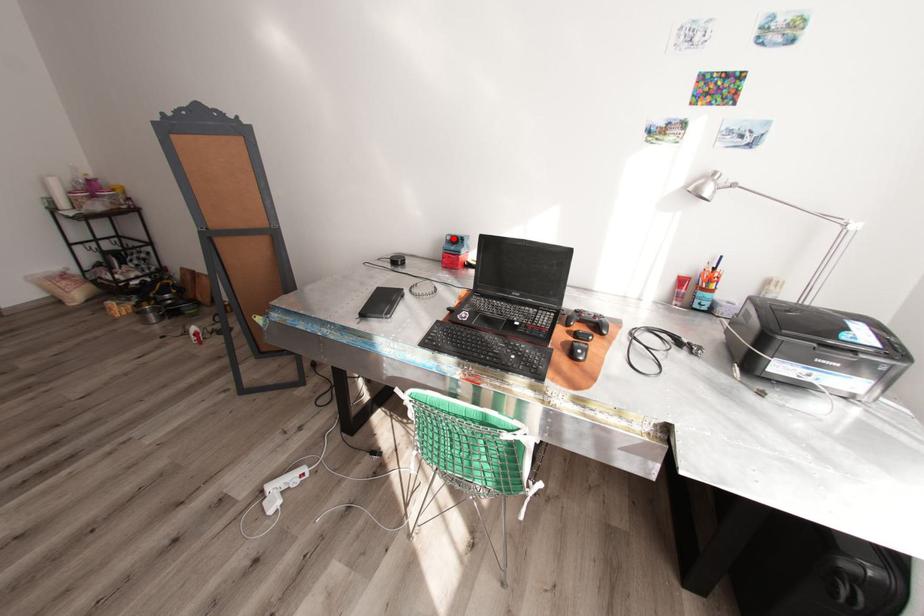
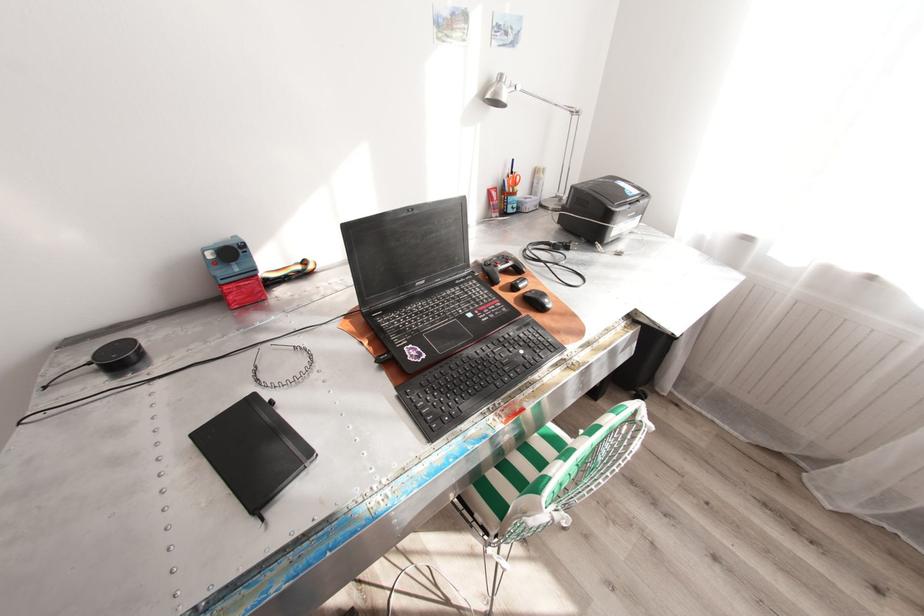
Question: I am providing you with two images of the same scene from different viewpoints. A red point is marked on the first image. Is the red point's position out of view in image 2?

Choices:
 (A) Yes
 (B) No

Answer: (B)